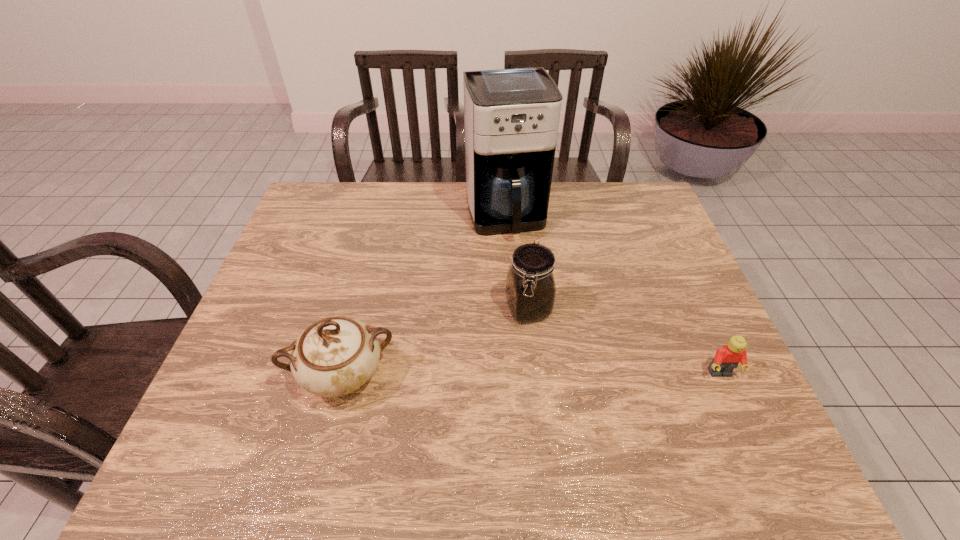
This screenshot has width=960, height=540. I want to click on vacant point located between the third nearest object and the rightmost object, so click(624, 342).

The image size is (960, 540). I want to click on free point between the third nearest object and the Lego, so click(x=624, y=342).

Find the location of a particular element. The width and height of the screenshot is (960, 540). free space between the second farthest object and the chinaware is located at coordinates (436, 342).

Identify the location of free spot between the leftmost object and the jar. 436,342.

Where is `the second closest object to the second farthest object`? This screenshot has width=960, height=540. the second closest object to the second farthest object is located at coordinates (335, 356).

This screenshot has width=960, height=540. What are the coordinates of `the second closest object relative to the jar` in the screenshot? It's located at (335, 356).

The height and width of the screenshot is (540, 960). What are the coordinates of `vacant space that satisfies the following two spatial constraints: 1. on the back side of the chinaware; 2. on the left side of the farthest object` in the screenshot? It's located at (384, 215).